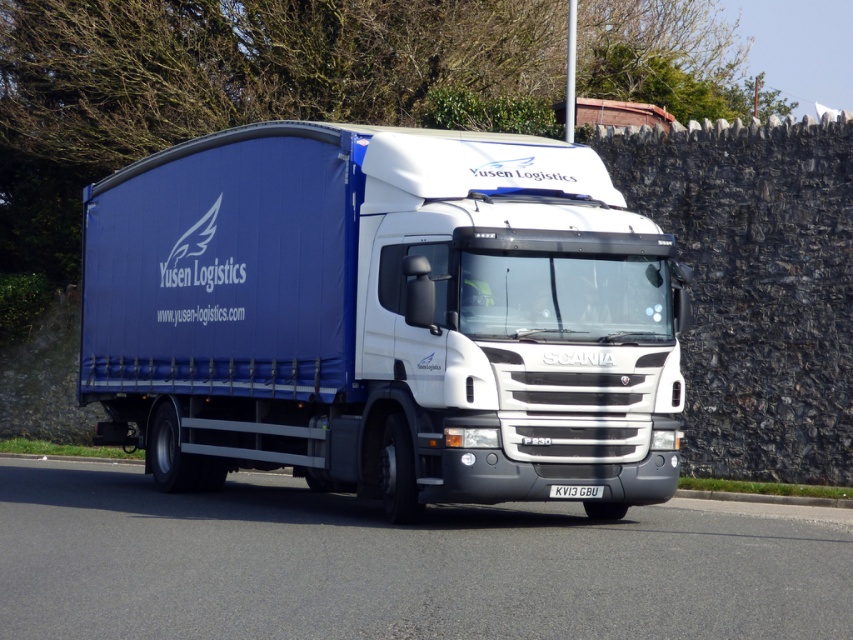
Question: Does blue fabric truck at center appear under white plastic license plate at center?

Choices:
 (A) no
 (B) yes

Answer: (A)

Question: Estimate the real-world distances between objects in this image. Which object is closer to the white plastic license plate at center?

Choices:
 (A) black asphalt road at center
 (B) blue fabric truck at center

Answer: (A)

Question: Which point appears farthest from the camera in this image?

Choices:
 (A) (579, 484)
 (B) (300, 182)
 (C) (245, 557)

Answer: (B)

Question: Is blue fabric truck at center positioned in front of black asphalt road at center?

Choices:
 (A) yes
 (B) no

Answer: (B)

Question: Can you confirm if blue fabric truck at center is positioned to the left of black asphalt road at center?

Choices:
 (A) yes
 (B) no

Answer: (A)

Question: Considering the real-world distances, which object is farthest from the black asphalt road at center?

Choices:
 (A) white plastic license plate at center
 (B) blue fabric truck at center

Answer: (A)